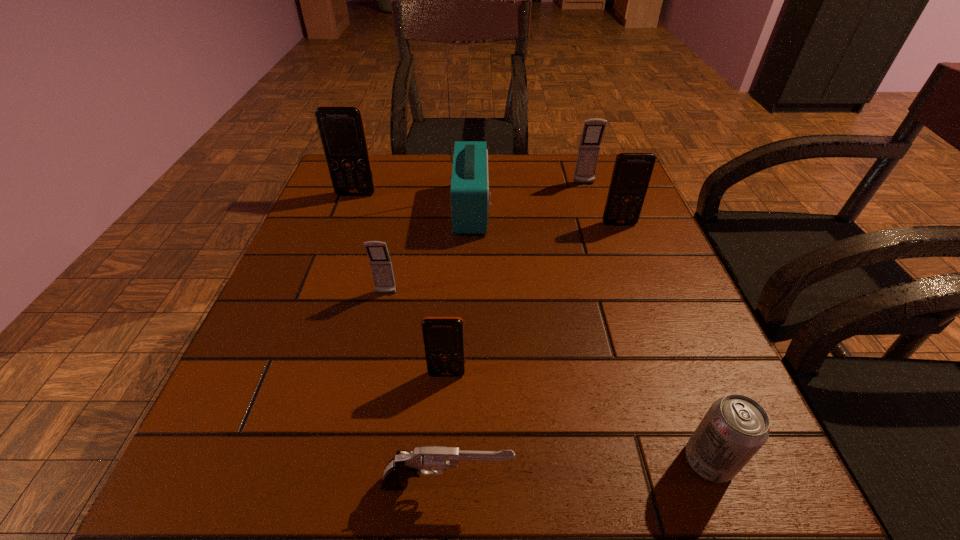
Find the location of a particular element. The width and height of the screenshot is (960, 540). vacant space situated on the back of the gray soda can is located at coordinates (660, 332).

Find the location of a particular element. vacant region located at the muzzle of the gun is located at coordinates (675, 485).

This screenshot has width=960, height=540. Find the location of `radio receiver at the far edge`. radio receiver at the far edge is located at coordinates (470, 203).

You are a GUI agent. You are given a task and a screenshot of the screen. Output one action in this format:
    pyautogui.click(x=<x>, y=<y>)
    Task: Click on the soda can that is positioned at the near edge
    
    Given the screenshot: What is the action you would take?
    pyautogui.click(x=735, y=427)

Find the location of a particular element. gun situated at the near edge is located at coordinates (404, 465).

Identify the location of object located at the left edge. This screenshot has width=960, height=540. pos(341,128).

Locate an element on the screen. This screenshot has width=960, height=540. soda can present at the right edge is located at coordinates (735, 427).

Identify the location of object at the far left corner. (341, 128).

I want to click on object that is at the far right corner, so click(x=593, y=130).

Where is `object positioned at the near right corner`? Image resolution: width=960 pixels, height=540 pixels. object positioned at the near right corner is located at coordinates (735, 427).